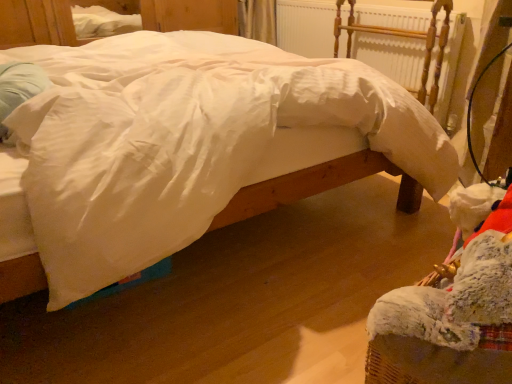
Question: Is white smooth bed at center surrounded by white painted wood radiator at upper center?

Choices:
 (A) no
 (B) yes

Answer: (A)

Question: Does white painted wood radiator at upper center have a lesser height compared to white smooth bed at center?

Choices:
 (A) yes
 (B) no

Answer: (A)

Question: Is white painted wood radiator at upper center wider than white smooth bed at center?

Choices:
 (A) no
 (B) yes

Answer: (A)

Question: Can you confirm if white painted wood radiator at upper center is positioned to the right of white smooth bed at center?

Choices:
 (A) yes
 (B) no

Answer: (A)

Question: Is white painted wood radiator at upper center in front of white smooth bed at center?

Choices:
 (A) yes
 (B) no

Answer: (B)

Question: From the image's perspective, is white smooth bed at center positioned above or below white painted wood radiator at upper center?

Choices:
 (A) below
 (B) above

Answer: (A)

Question: Based on their sizes in the image, would you say white smooth bed at center is bigger or smaller than white painted wood radiator at upper center?

Choices:
 (A) small
 (B) big

Answer: (B)

Question: Visually, is white smooth bed at center positioned to the left or to the right of white painted wood radiator at upper center?

Choices:
 (A) right
 (B) left

Answer: (B)

Question: Considering the positions of white smooth bed at center and white painted wood radiator at upper center in the image, is white smooth bed at center taller or shorter than white painted wood radiator at upper center?

Choices:
 (A) short
 (B) tall

Answer: (B)

Question: Is white painted wood radiator at upper center situated inside white soft pillow at left or outside?

Choices:
 (A) outside
 (B) inside

Answer: (A)

Question: In terms of width, does white painted wood radiator at upper center look wider or thinner when compared to white soft pillow at left?

Choices:
 (A) thin
 (B) wide

Answer: (A)

Question: Is point (380, 36) closer or farther from the camera than point (46, 84)?

Choices:
 (A) farther
 (B) closer

Answer: (A)

Question: Relative to white soft pillow at left, is white painted wood radiator at upper center in front or behind?

Choices:
 (A) front
 (B) behind

Answer: (B)

Question: Does point pyautogui.click(x=27, y=66) appear closer or farther from the camera than point pyautogui.click(x=379, y=66)?

Choices:
 (A) farther
 (B) closer

Answer: (B)

Question: Which is correct: white soft pillow at left is inside white painted wood radiator at upper center, or outside of it?

Choices:
 (A) inside
 (B) outside

Answer: (B)